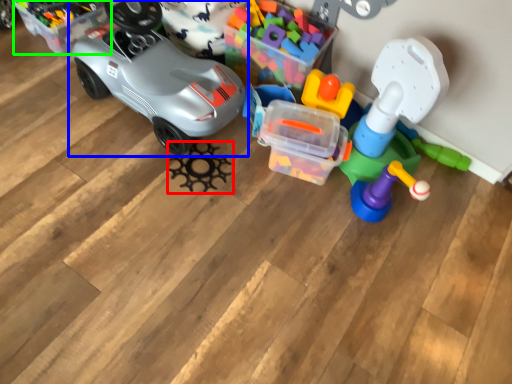
Question: Which object is positioned farthest from toy (highlighted by a red box)? Select from car (highlighted by a blue box) and storage box (highlighted by a green box).

Choices:
 (A) car
 (B) storage box

Answer: (B)